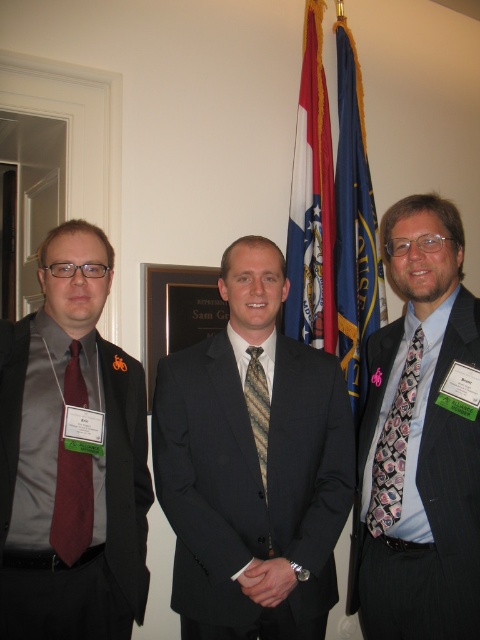
You are organizing a charity event and need to ensure that all participants wear attire that meets specific size requirements. You have a dark gray suit at center and a patterned silk tie at center. Which item is larger in size?

The dark gray suit at center is larger in size compared to the patterned silk tie at center according to the description.

Based on the scene description, which object is taller between the wooden plaque at center and the floral silk tie at right?

The floral silk tie at right is taller than the wooden plaque at center.